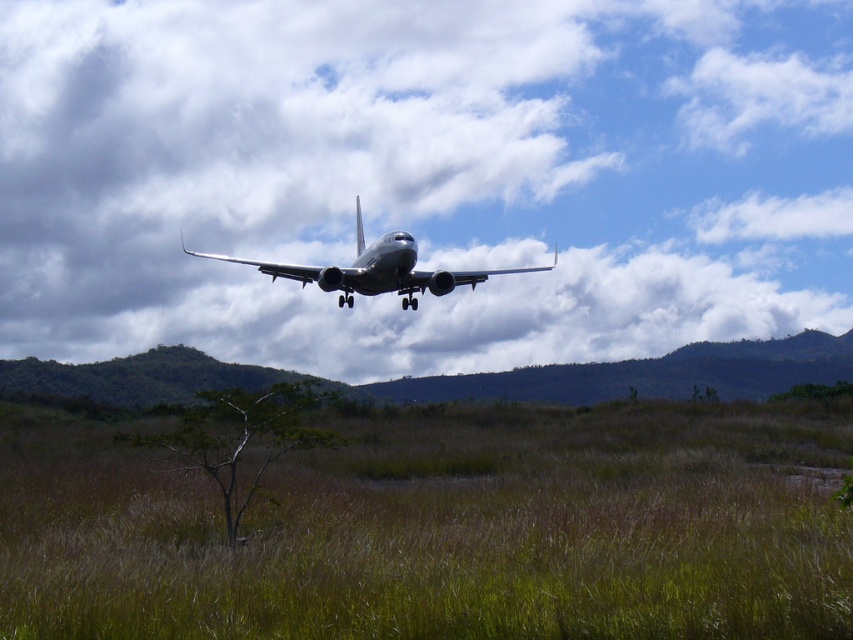
Question: Which point is closer to the camera?

Choices:
 (A) 711,13
 (B) 257,268
 (C) 653,588

Answer: (C)

Question: Which is nearer to the brown dry grass at center?

Choices:
 (A) metallic gray airplane at center
 (B) white fluffy cloud at upper center
 (C) green matte tree at center

Answer: (A)

Question: Which of these objects is positioned farthest from the metallic gray airplane at center?

Choices:
 (A) brown dry grass at center
 (B) green matte tree at center

Answer: (B)

Question: Is brown dry grass at center smaller than metallic gray airplane at center?

Choices:
 (A) no
 (B) yes

Answer: (B)

Question: Does green matte tree at center have a greater width compared to metallic gray airplane at center?

Choices:
 (A) yes
 (B) no

Answer: (B)

Question: Where is green matte tree at center located in relation to metallic gray airplane at center in the image?

Choices:
 (A) right
 (B) left

Answer: (A)